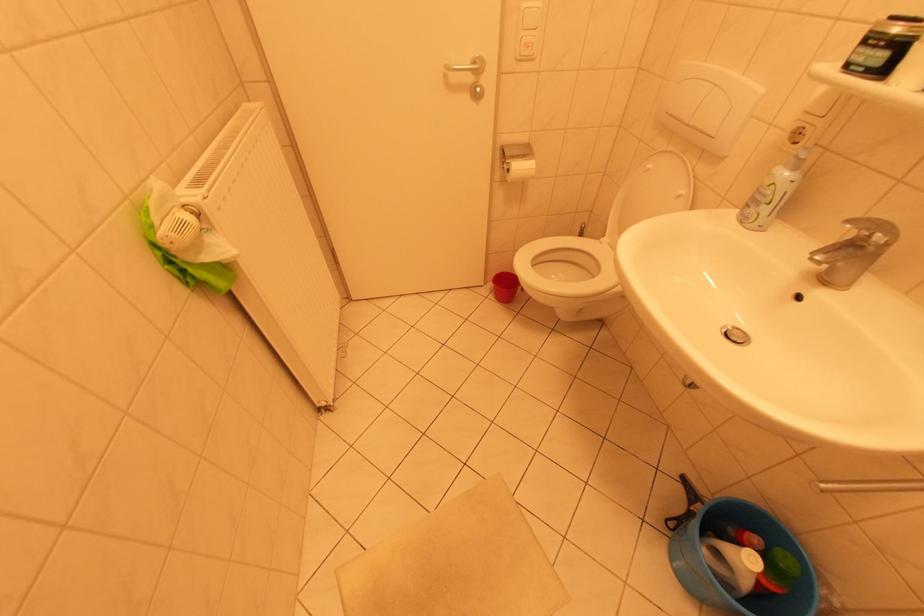
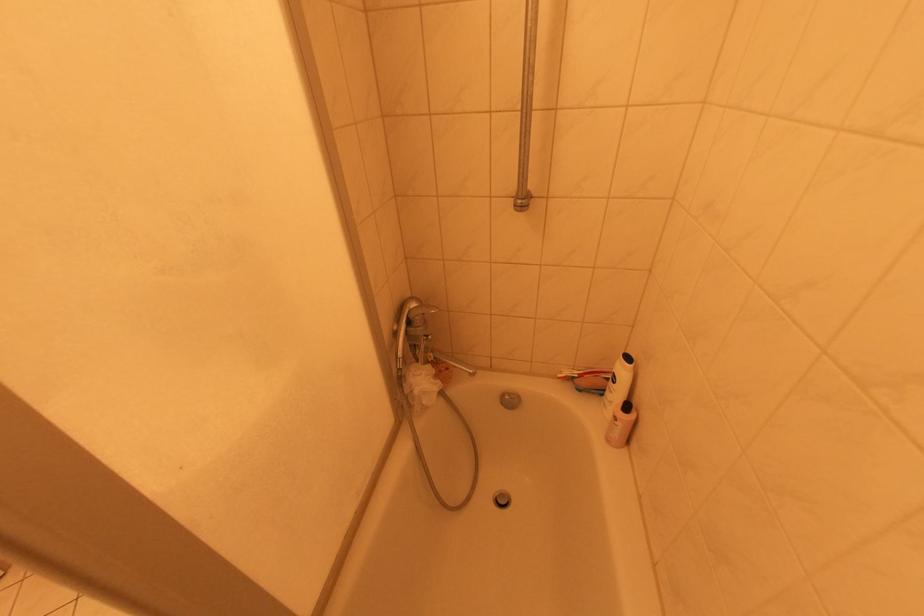
Question: The camera is either moving clockwise (left) or counter-clockwise (right) around the object. The first image is from the beginning of the video and the second image is from the end. Is the camera moving left or right when shooting the video?

Choices:
 (A) Left
 (B) Right

Answer: (A)